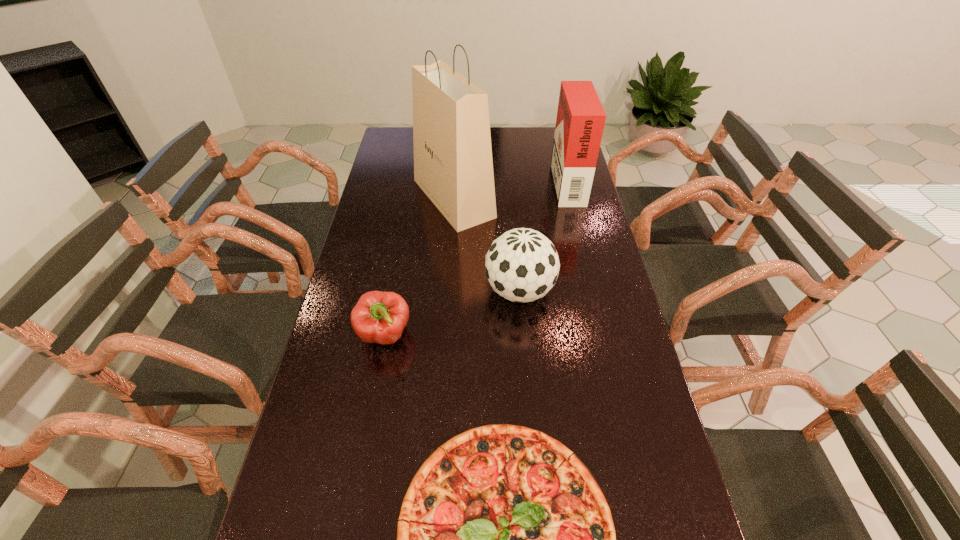
Find the location of `the tallest object`. the tallest object is located at coordinates (453, 165).

The height and width of the screenshot is (540, 960). What are the coordinates of `cigarette case` in the screenshot? It's located at (580, 121).

Identify the location of the second tallest object. (580, 121).

Find the location of `soccer ball`. soccer ball is located at coordinates (522, 265).

At what (x,y) coordinates should I click in order to perform the action: click on bell pepper. Please return your answer as a coordinate pair (x, y). The width and height of the screenshot is (960, 540). Looking at the image, I should click on (379, 317).

Find the location of a particular element. vacant space situated 0.190m on the back of the shopping bag is located at coordinates pos(457,146).

Locate an element on the screen. This screenshot has height=540, width=960. vacant space situated 0.270m on the front-facing side of the cigarette case is located at coordinates (485, 181).

At what (x,y) coordinates should I click in order to perform the action: click on vacant point located on the front-facing side of the cigarette case. Please return your answer as a coordinate pair (x, y). Looking at the image, I should click on (492, 181).

Find the location of a particular element. The image size is (960, 540). free space located 0.290m on the front-facing side of the cigarette case is located at coordinates (480, 181).

This screenshot has width=960, height=540. Identify the location of free space located 0.380m on the back of the soccer ball. (512, 197).